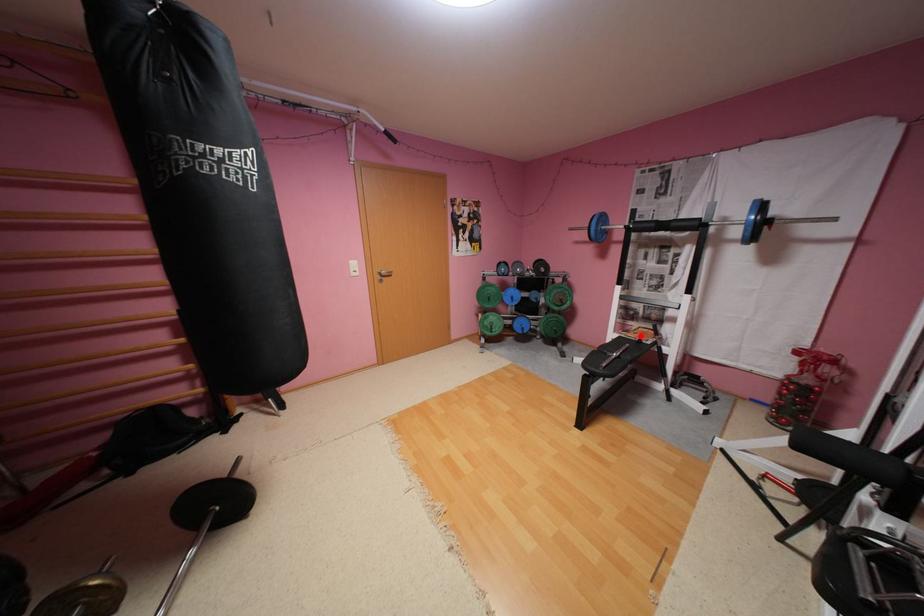
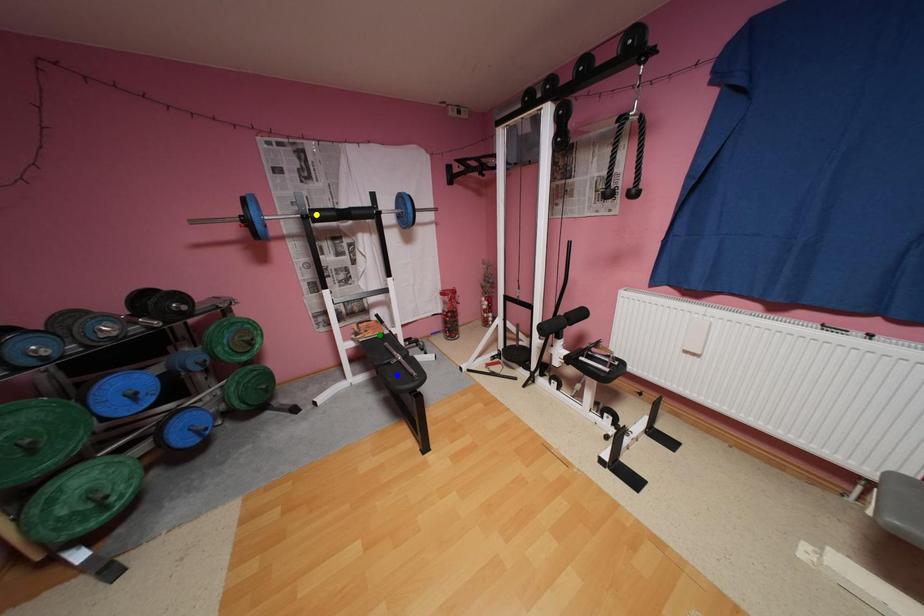
Question: I am providing you with two images of the same scene from different viewpoints. A red point is marked on the first image. You are given multiple points on the second image. Which spot in image 2 lines up with the point in image 1?

Choices:
 (A) green point
 (B) blue point
 (C) yellow point

Answer: (A)